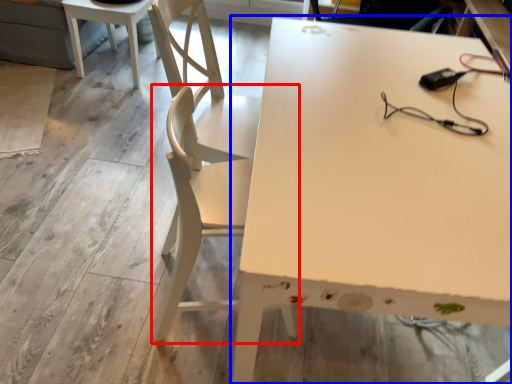
Question: Which point is further to the camera, chair (highlighted by a red box) or table (highlighted by a blue box)?

Choices:
 (A) chair
 (B) table

Answer: (A)